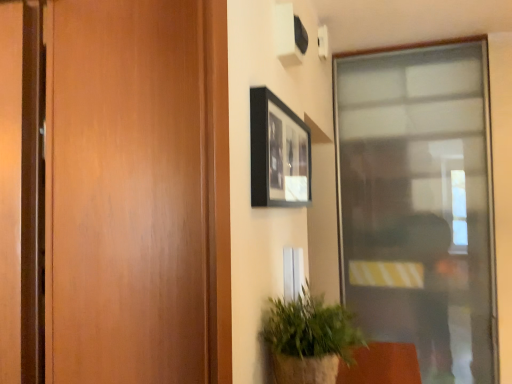
Question: From a real-world perspective, relative to black matte picture frame at upper center, is green textured plant at lower right vertically above or below?

Choices:
 (A) below
 (B) above

Answer: (A)

Question: From the image's perspective, is green textured plant at lower right positioned above or below black matte picture frame at upper center?

Choices:
 (A) below
 (B) above

Answer: (A)

Question: Estimate the real-world distances between objects in this image. Which object is closer to the black matte picture frame at upper center?

Choices:
 (A) transparent glass door at right
 (B) green textured plant at lower right

Answer: (B)

Question: Considering the real-world distances, which object is closest to the transparent glass door at right?

Choices:
 (A) green textured plant at lower right
 (B) black matte picture frame at upper center

Answer: (B)